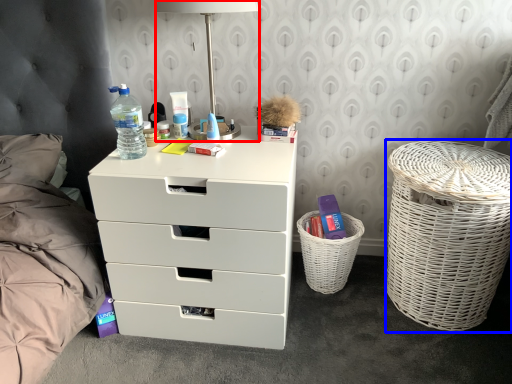
Question: Which object is closer to the camera taking this photo, table lamp (highlighted by a red box) or laundry basket (highlighted by a blue box)?

Choices:
 (A) table lamp
 (B) laundry basket

Answer: (A)